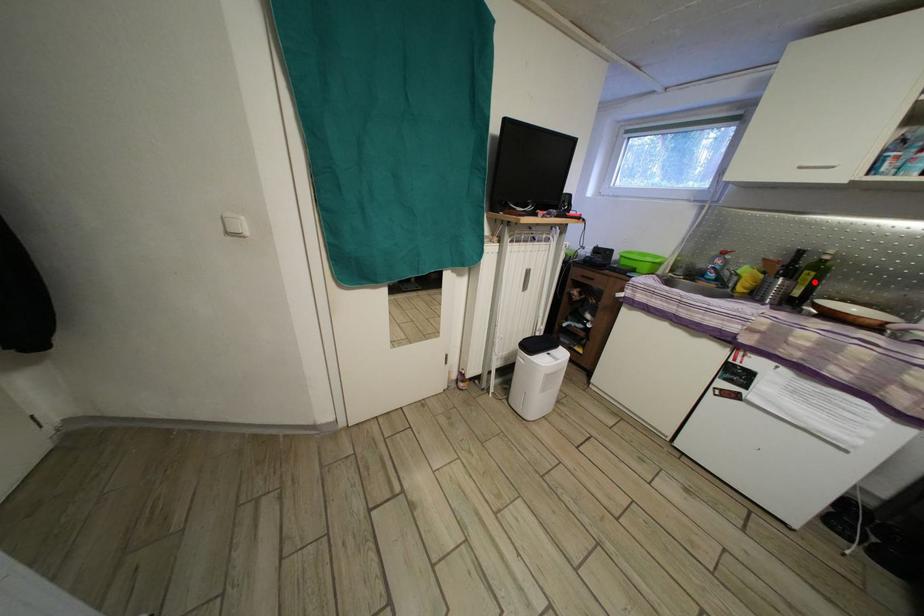
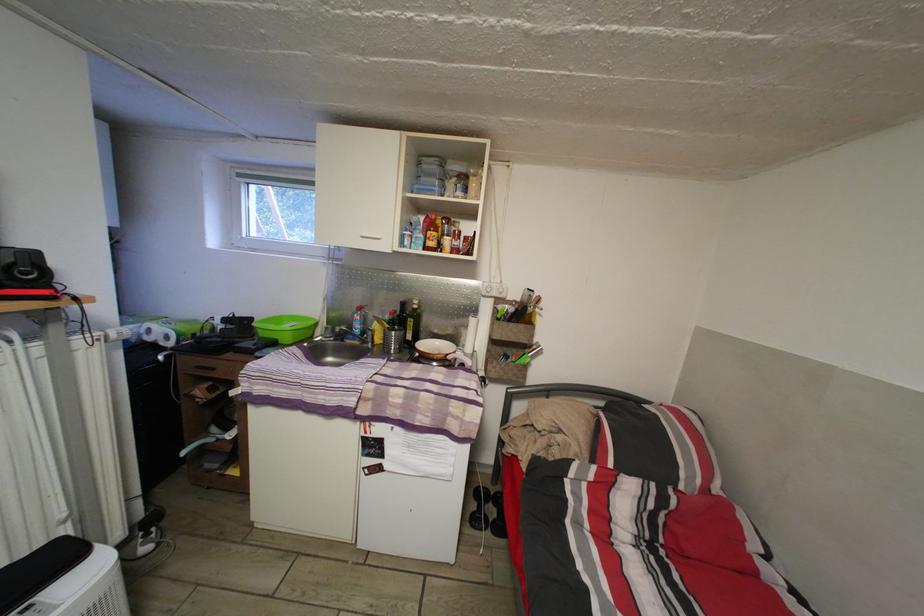
Question: A red point is marked in image1. In image2, is the corresponding 3D point closer to the camera or farther? Reply with the corresponding letter.

Choices:
 (A) The corresponding 3D point is closer.
 (B) The corresponding 3D point is farther.

Answer: (A)